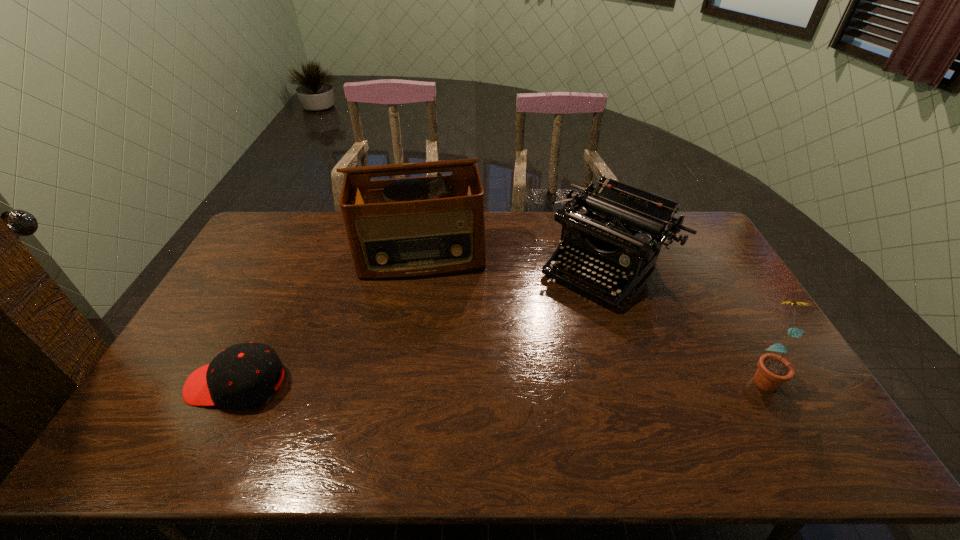
Where is `vacant spot on the desktop that is between the leftmost object and the rightmost object and is positioned on the keyboard of the typewriter`? The width and height of the screenshot is (960, 540). vacant spot on the desktop that is between the leftmost object and the rightmost object and is positioned on the keyboard of the typewriter is located at coordinates (496, 379).

This screenshot has height=540, width=960. Find the location of `free space on the desktop that is between the leftmost object and the rightmost object and is positioned on the front panel of the tallest object`. free space on the desktop that is between the leftmost object and the rightmost object and is positioned on the front panel of the tallest object is located at coordinates (428, 380).